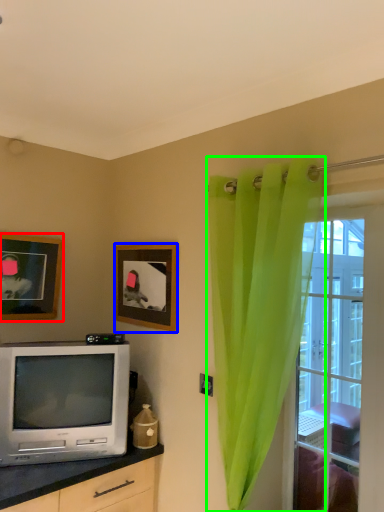
Question: Based on their relative distances, which object is nearer to picture frame (highlighted by a red box)? Choose from picture frame (highlighted by a blue box) and curtain (highlighted by a green box).

Choices:
 (A) picture frame
 (B) curtain

Answer: (A)